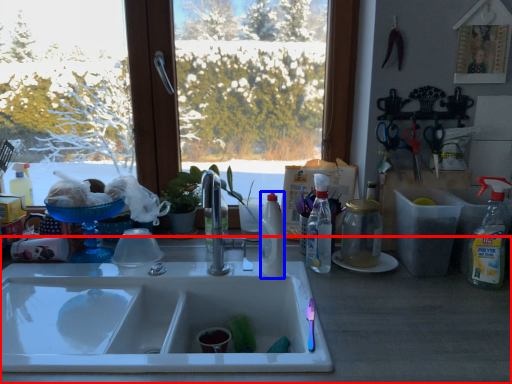
Question: Which object appears farthest to the camera in this image, counter top (highlighted by a red box) or bottle (highlighted by a blue box)?

Choices:
 (A) counter top
 (B) bottle

Answer: (B)